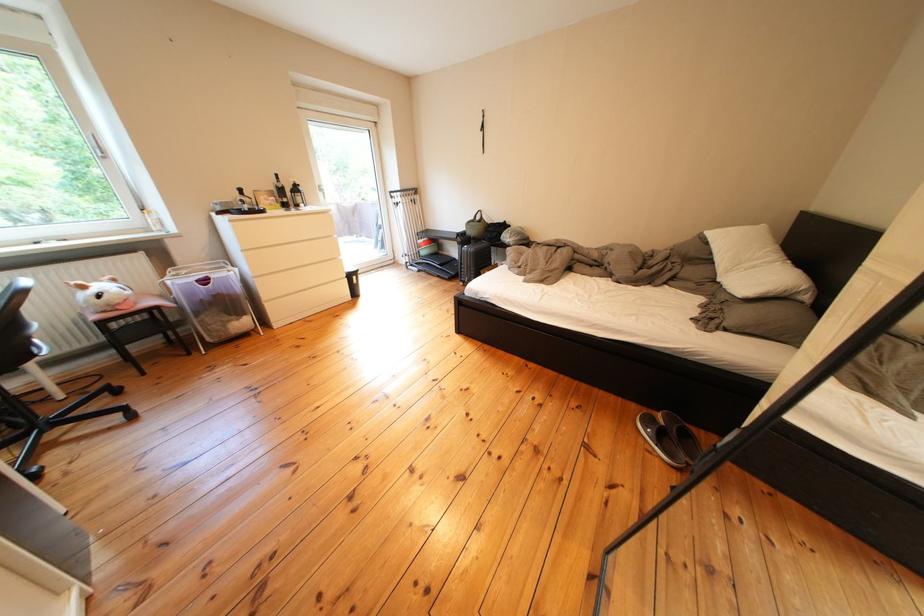
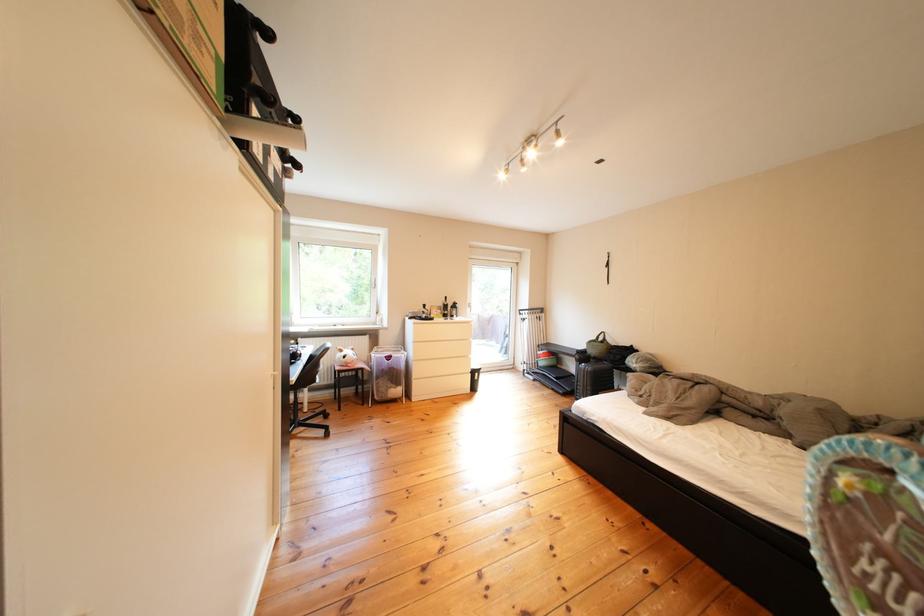
Locate, in the second image, the point that corresponds to (x=113, y=301) in the first image.

(359, 361)